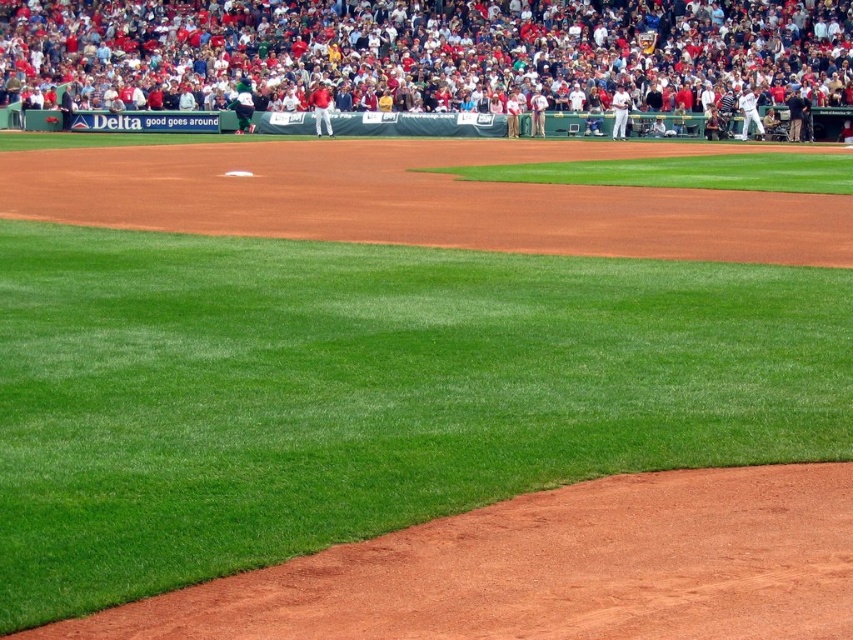
Question: Considering the real-world distances, which object is closest to the white uniform at upper right?

Choices:
 (A) white uniform at upper center
 (B) white uniformed player at upper center
 (C) light brown uniform at center
 (D) dark green jersey at upper center

Answer: (C)

Question: Is white uniformed player at upper center above white uniform at upper right?

Choices:
 (A) yes
 (B) no

Answer: (A)

Question: Which of the following is the farthest from the observer?

Choices:
 (A) (546, 102)
 (B) (619, 92)
 (C) (109, 125)

Answer: (C)

Question: Does white uniform at upper center have a larger size compared to light brown uniform at center?

Choices:
 (A) yes
 (B) no

Answer: (B)

Question: Among these objects, which one is nearest to the camera?

Choices:
 (A) white matte baseball bat at upper right
 (B) light brown uniform at center
 (C) white uniform at upper right
 (D) white uniform at upper center

Answer: (A)

Question: Can you confirm if dark green jersey at upper center is thinner than light brown uniform at center?

Choices:
 (A) no
 (B) yes

Answer: (A)